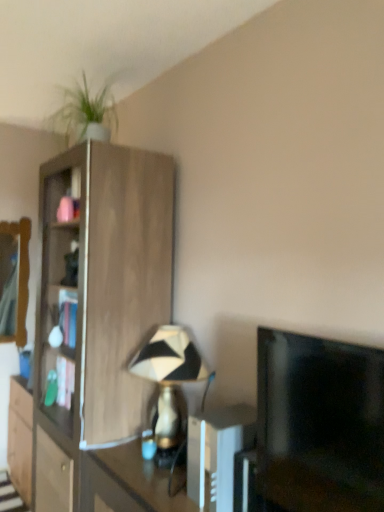
What is the approximate height of wooden cabinet at left?

wooden cabinet at left is 6.78 feet in height.

Locate an element on the screen. Image resolution: width=384 pixels, height=512 pixels. white plastic remote control at center is located at coordinates (217, 453).

You are a GUI agent. You are given a task and a screenshot of the screen. Output one action in this format:
    pyautogui.click(x=<x>, y=<y>)
    Task: Click on the black and white geometric lampshade at center
    Image resolution: width=384 pixels, height=512 pixels.
    Given the screenshot: What is the action you would take?
    pyautogui.click(x=169, y=376)

What is the approximate height of wooden mirror at left?

1.04 meters.

I want to click on wooden cabinet at left, so click(x=97, y=303).

Find the location of a particular element. television on the right of white plastic remote control at center is located at coordinates (319, 423).

Is point (296, 494) positioned behind point (198, 475)?

No.

From a real-world perspective, is black glossy tv at right on white plastic remote control at center?

Yes, from a real-world perspective, black glossy tv at right is over white plastic remote control at center

Based on their sizes in the image, would you say black glossy tv at right is bigger or smaller than white plastic remote control at center?

In the image, black glossy tv at right appears to be larger than white plastic remote control at center.

Looking at this image, how different are the orientations of wooden cabinet at left and wooden mirror at left in degrees?

There is a 92.1-degree angle between the facing directions of wooden cabinet at left and wooden mirror at left.

From a real-world perspective, is wooden cabinet at left on top of wooden mirror at left?

Incorrect, from a real-world perspective, wooden cabinet at left is lower than wooden mirror at left.

Is wooden cabinet at left further to camera compared to wooden mirror at left?

No, wooden cabinet at left is in front of wooden mirror at left.

Is wooden cabinet at left next to wooden mirror at left?

No, wooden cabinet at left is not beside wooden mirror at left.

Based on the photo, considering the sizes of wooden mirror at left and white plastic remote control at center in the image, is wooden mirror at left wider or thinner than white plastic remote control at center?

Considering their sizes, wooden mirror at left looks slimmer than white plastic remote control at center.

Is wooden mirror at left not near white plastic remote control at center?

Yes, wooden mirror at left is far from white plastic remote control at center.

Can you tell me how much wooden mirror at left and white plastic remote control at center differ in facing direction?

91.1 degrees.

Considering the points (23, 263) and (205, 439), which point is in front, point (23, 263) or point (205, 439)?

The point (205, 439) is in front.

Can we say white plastic remote control at center lies outside black glossy tv at right?

white plastic remote control at center lies outside black glossy tv at right's area.

Is white plastic remote control at center oriented towards black glossy tv at right?

No, white plastic remote control at center is not facing towards black glossy tv at right.

Who is shorter, white plastic remote control at center or black glossy tv at right?

white plastic remote control at center.

From the image's perspective, is white plastic remote control at center under black glossy tv at right?

Yes, from the image's perspective, white plastic remote control at center is beneath black glossy tv at right.

From the image's perspective, which one is positioned lower, white plastic remote control at center or wooden cabinet at left?

white plastic remote control at center appears lower in the image.

Is white plastic remote control at center next to wooden cabinet at left?

No.

Consider the image. Is white plastic remote control at center smaller than wooden cabinet at left?

Correct, white plastic remote control at center occupies less space than wooden cabinet at left.

Where is `appliance that appears below the wooden cabinet at left (from a real-world perspective)`? Image resolution: width=384 pixels, height=512 pixels. appliance that appears below the wooden cabinet at left (from a real-world perspective) is located at coordinates (217, 453).

Choose the correct answer: Is wooden mirror at left inside black glossy tv at right or outside it?

wooden mirror at left exists outside the volume of black glossy tv at right.

From a real-world perspective, is wooden mirror at left positioned under black glossy tv at right based on gravity?

Actually, wooden mirror at left is physically above black glossy tv at right in the real world.

From the image's perspective, between wooden mirror at left and black glossy tv at right, which one is located above?

wooden mirror at left appears higher in the image.

Does point (21, 277) come in front of point (288, 489)?

No, it is not.

Which is more to the right, black and white geometric lampshade at center or wooden mirror at left?

black and white geometric lampshade at center is more to the right.

Looking at this image, between black and white geometric lampshade at center and wooden mirror at left, which one has more height?

Standing taller between the two is wooden mirror at left.

Looking at this image, is wooden mirror at left inside black and white geometric lampshade at center?

No, black and white geometric lampshade at center does not contain wooden mirror at left.

Identify the location of appliance behind the black glossy tv at right. (217, 453).

The image size is (384, 512). In order to click on cupboard on the right of the wooden mirror at left in this screenshot , I will do `click(97, 303)`.

Looking at this image, based on their spatial positions, is black and white geometric lampshade at center or wooden mirror at left closer to white plastic remote control at center?

black and white geometric lampshade at center is closer to white plastic remote control at center.

Based on their spatial positions, is white plastic remote control at center or wooden cabinet at left further from wooden mirror at left?

Among the two, white plastic remote control at center is located further to wooden mirror at left.

Estimate the real-world distances between objects in this image. Which object is further from wooden mirror at left, black and white geometric lampshade at center or black glossy tv at right?

black glossy tv at right is positioned further to the anchor wooden mirror at left.

Looking at the image, which one is located further to black glossy tv at right, black and white geometric lampshade at center or white plastic remote control at center?

Among the two, black and white geometric lampshade at center is located further to black glossy tv at right.

Based on their spatial positions, is black and white geometric lampshade at center or white plastic remote control at center closer to wooden mirror at left?

Among the two, black and white geometric lampshade at center is located nearer to wooden mirror at left.

Looking at the image, which one is located further to white plastic remote control at center, wooden cabinet at left or wooden mirror at left?

wooden mirror at left.

From the image, which object appears to be farther from wooden cabinet at left, black and white geometric lampshade at center or white plastic remote control at center?

Among the two, white plastic remote control at center is located further to wooden cabinet at left.

Estimate the real-world distances between objects in this image. Which object is closer to wooden mirror at left, black glossy tv at right or black and white geometric lampshade at center?

black and white geometric lampshade at center is closer to wooden mirror at left.

Where is `table lamp between black glossy tv at right and wooden mirror at left from front to back`? The image size is (384, 512). table lamp between black glossy tv at right and wooden mirror at left from front to back is located at coordinates (169, 376).

Find the location of a particular element. This screenshot has width=384, height=512. cupboard between white plastic remote control at center and wooden mirror at left along the z-axis is located at coordinates (97, 303).

The width and height of the screenshot is (384, 512). What are the coordinates of `cupboard between black and white geometric lampshade at center and wooden mirror at left in the front-back direction` in the screenshot? It's located at (97, 303).

Where is `table lamp between black glossy tv at right and wooden cabinet at left in the front-back direction`? table lamp between black glossy tv at right and wooden cabinet at left in the front-back direction is located at coordinates (169, 376).